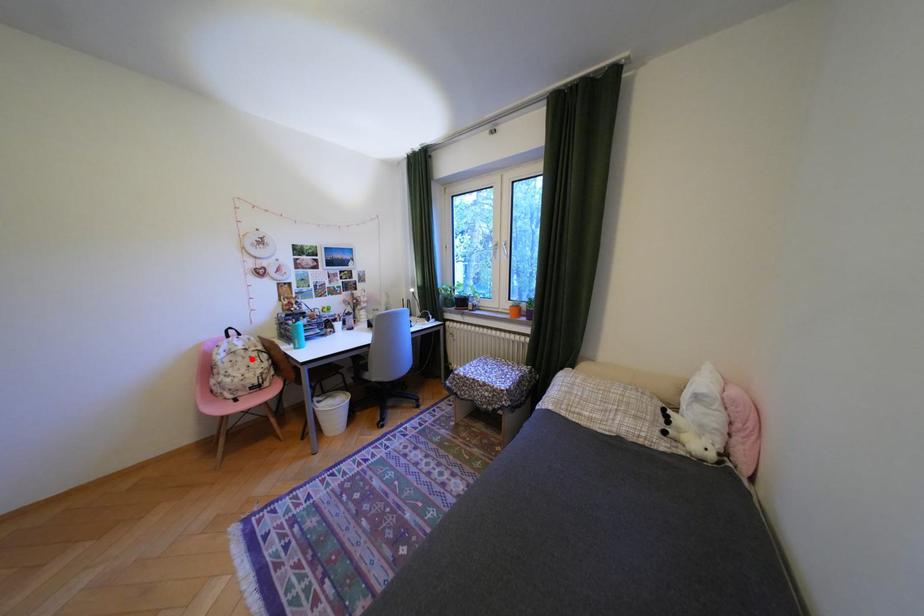
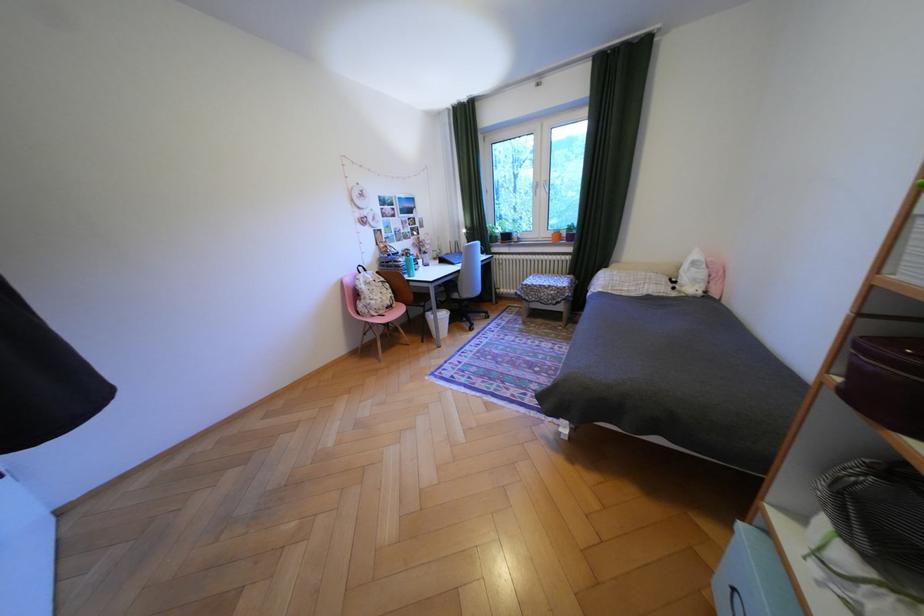
In the second image, find the point that corresponds to the highlighted location in the first image.

(386, 288)